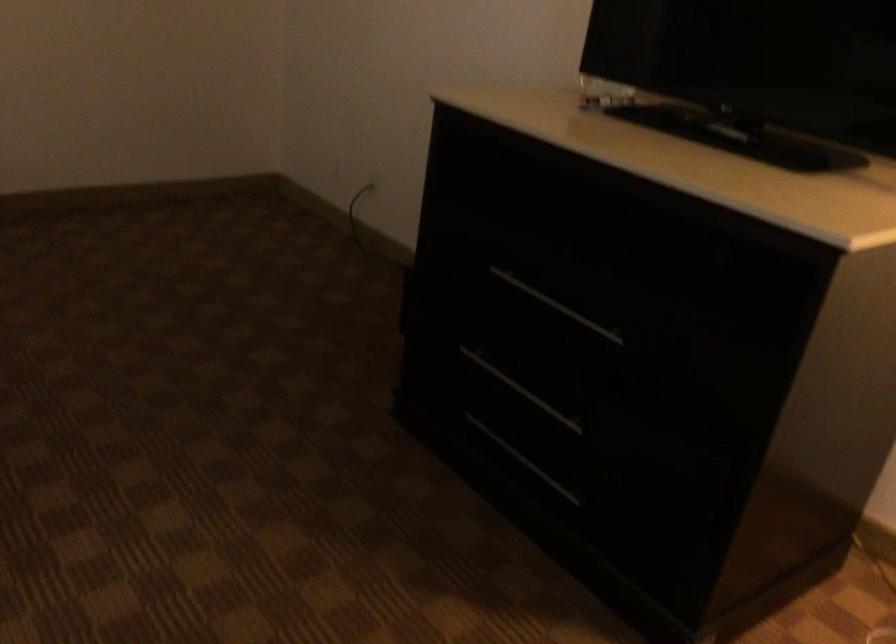
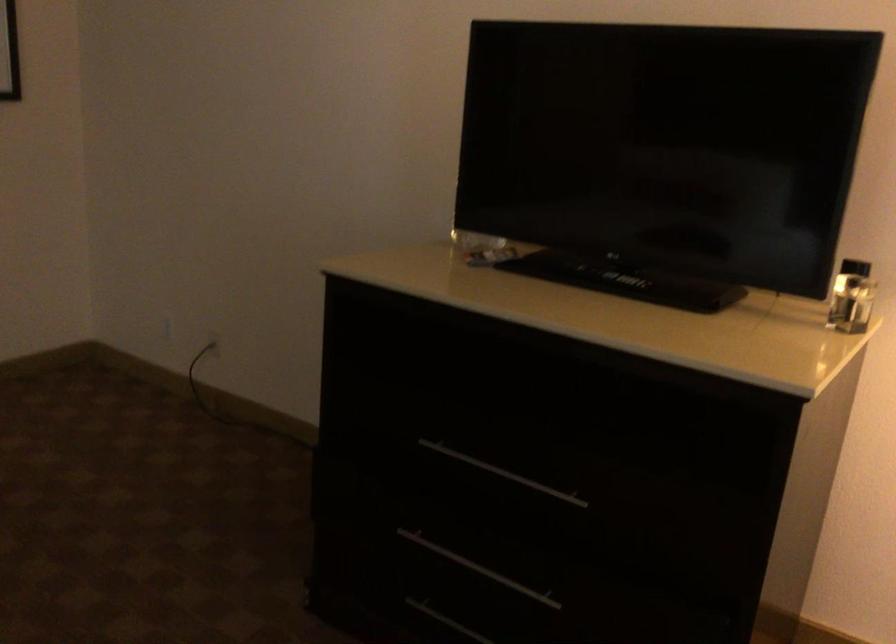
In the second image, find the point that corresponds to [724,131] in the first image.

(625, 279)